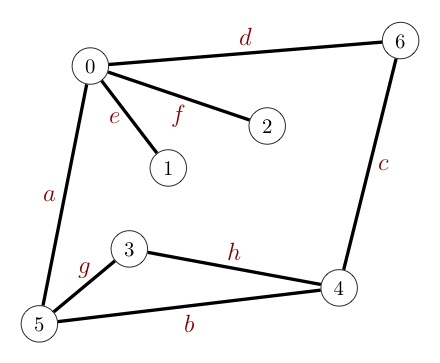
You are a GUI agent. You are given a task and a screenshot of the screen. Output one action in this format:
    pyautogui.click(x=<x>, y=<y>)
    Task: Click on the corner
    
    Given the screenshot: What is the action you would take?
    pyautogui.click(x=51, y=329)